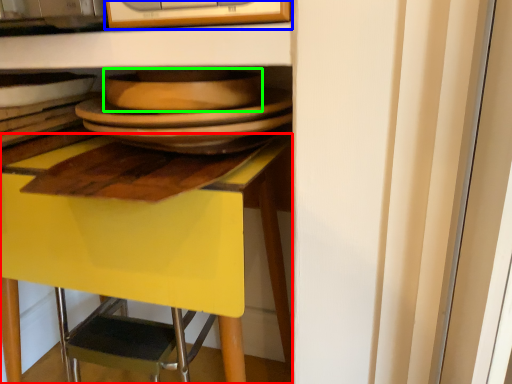
Question: Which object is positioned closest to desk (highlighted by a red box)? Select from appliance (highlighted by a blue box) and platter (highlighted by a green box).

Choices:
 (A) appliance
 (B) platter

Answer: (B)